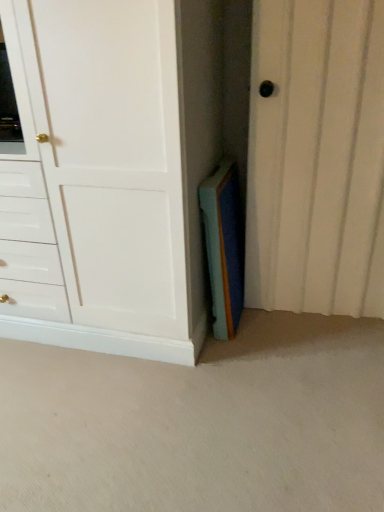
Question: Is white textured door at center situated inside white matte cabinet at center or outside?

Choices:
 (A) outside
 (B) inside

Answer: (A)

Question: Relative to white matte cabinet at center, is white textured door at center in front or behind?

Choices:
 (A) front
 (B) behind

Answer: (B)

Question: Which object is the closest to the white matte cabinet at center?

Choices:
 (A) blue felt book at center
 (B) white textured door at center

Answer: (A)

Question: Considering the real-world distances, which object is farthest from the blue felt book at center?

Choices:
 (A) white matte cabinet at center
 (B) white textured door at center

Answer: (A)